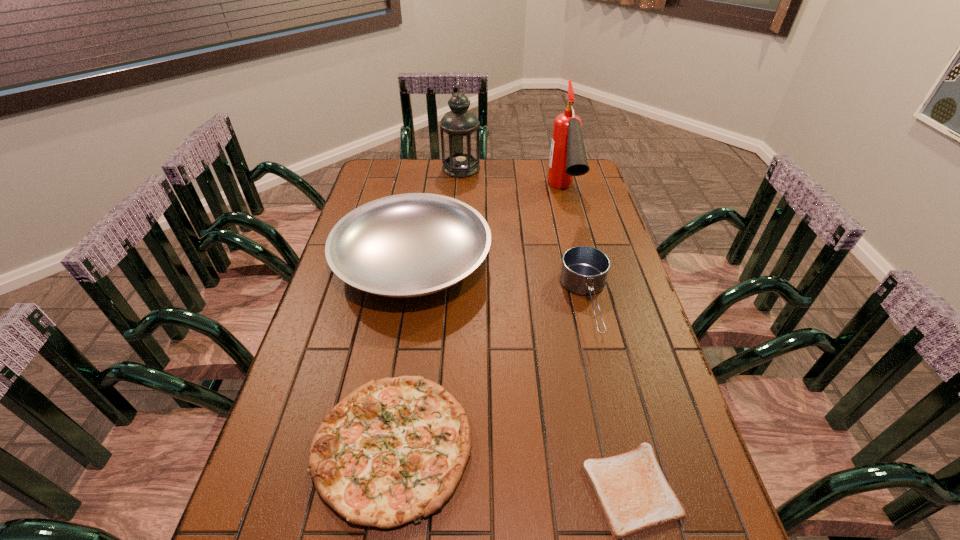
The height and width of the screenshot is (540, 960). I want to click on free space at the far edge of the desktop, so click(536, 166).

At what (x,y) coordinates should I click in order to perform the action: click on blank space at the left edge. Please return your answer as a coordinate pair (x, y). This screenshot has width=960, height=540. Looking at the image, I should click on (339, 280).

Locate an element on the screen. The height and width of the screenshot is (540, 960). free space at the right edge of the desktop is located at coordinates (604, 348).

You are a GUI agent. You are given a task and a screenshot of the screen. Output one action in this format:
    pyautogui.click(x=<x>, y=<y>)
    Task: Click on the vacant space at the far left corner of the desktop
    
    Given the screenshot: What is the action you would take?
    pyautogui.click(x=394, y=184)

You are a GUI agent. You are given a task and a screenshot of the screen. Output one action in this format:
    pyautogui.click(x=<x>, y=<y>)
    Task: Click on the vacant space that is in between the third shortest object and the pizza
    
    Given the screenshot: What is the action you would take?
    pyautogui.click(x=491, y=375)

Identify the location of empty space that is in between the fire extinguisher and the toast. The width and height of the screenshot is (960, 540). (597, 342).

This screenshot has width=960, height=540. Find the location of `free space between the shortest object and the fire extinguisher`. free space between the shortest object and the fire extinguisher is located at coordinates click(x=597, y=342).

Identify the location of free space between the fourth shortest object and the saucepan. The image size is (960, 540). (500, 282).

This screenshot has height=540, width=960. Identify the location of empty location between the saucepan and the bedpan. (500, 282).

Where is `vacant region between the shortest object and the fourth tallest object`? Image resolution: width=960 pixels, height=540 pixels. vacant region between the shortest object and the fourth tallest object is located at coordinates (610, 396).